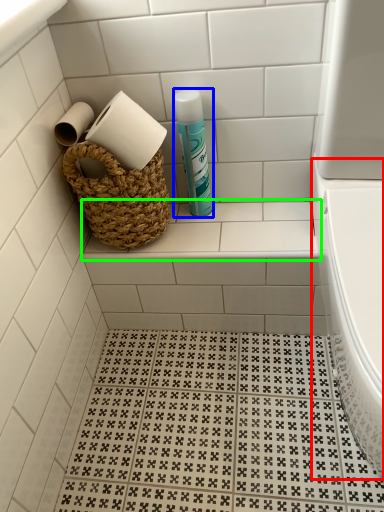
Question: Based on their relative distances, which object is nearer to bath (highlighted by a red box)? Choose from cleaning product (highlighted by a blue box) and ledge (highlighted by a green box).

Choices:
 (A) cleaning product
 (B) ledge

Answer: (B)